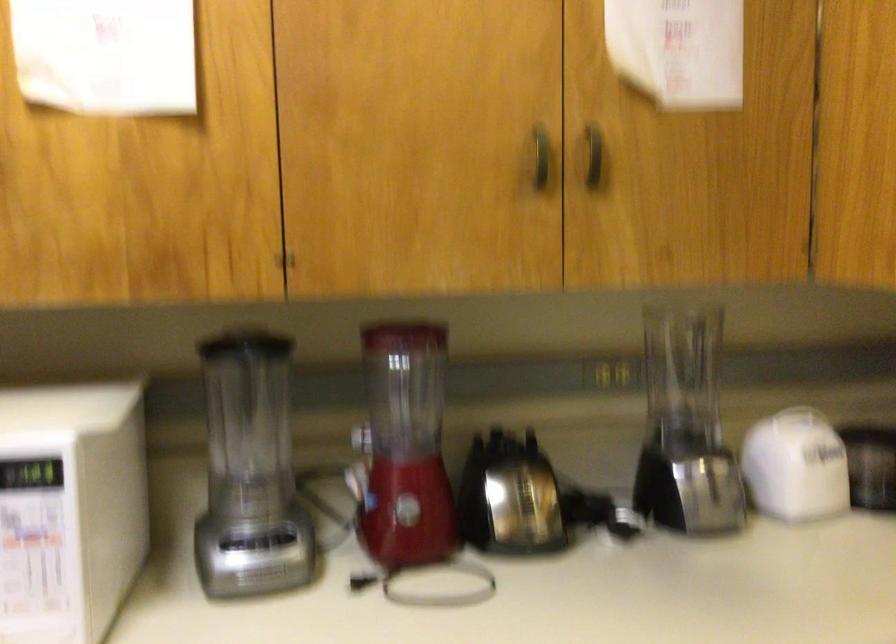
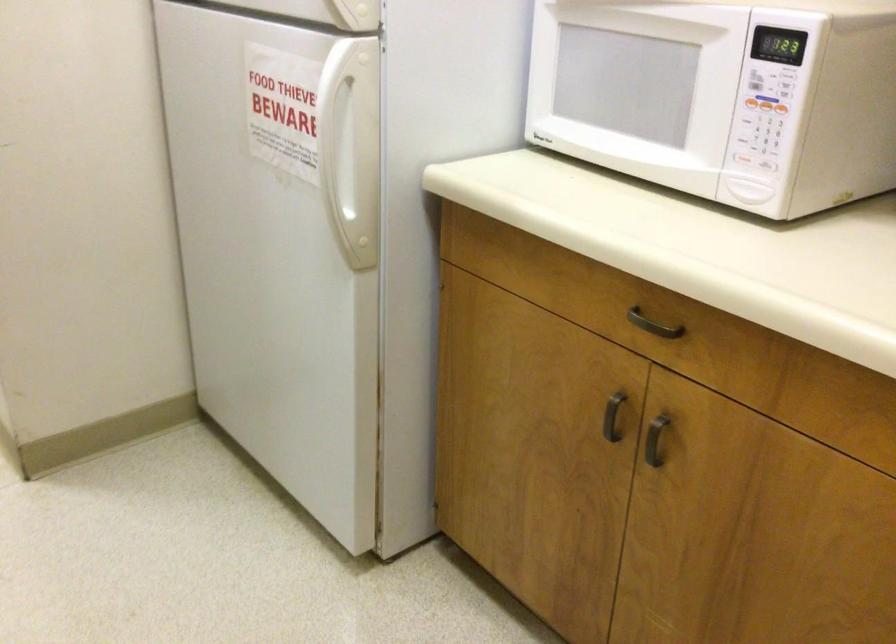
The images are taken continuously from a first-person perspective. In which direction is your viewpoint rotating?

The camera rotated toward left-down.